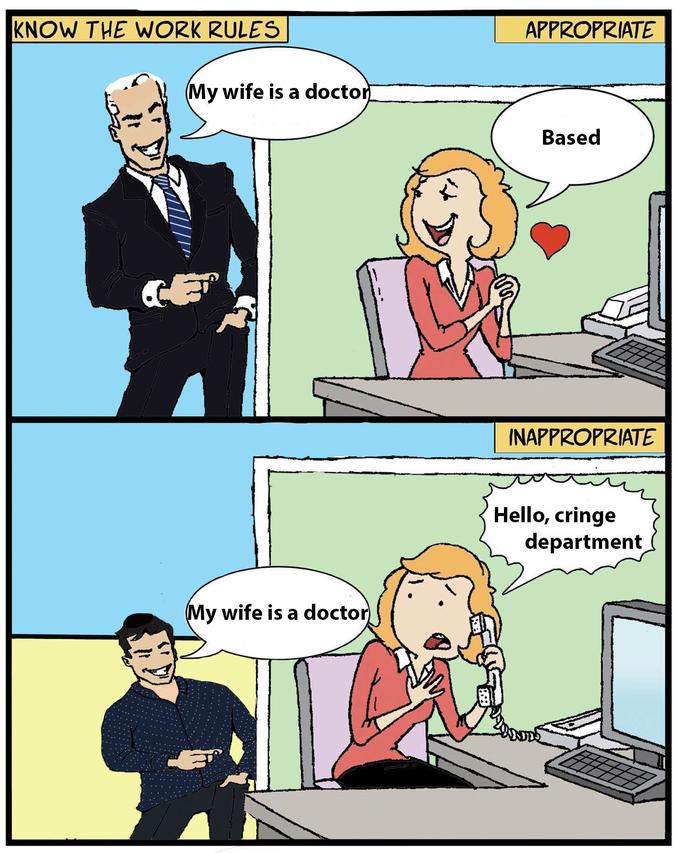
Locate an element on the screen. This screenshot has height=853, width=680. wall is located at coordinates pos(409,49), pos(347,442).